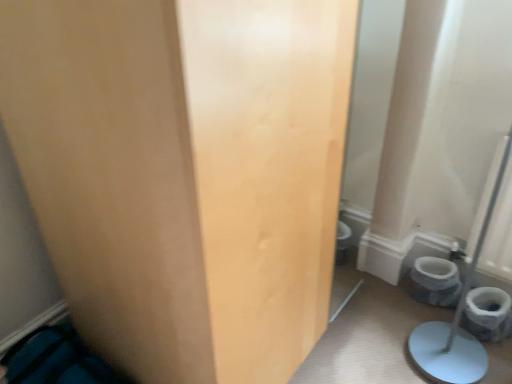
Question: From the image's perspective, would you say matte wood door at center is positioned over gray matte toilet bowl at lower right?

Choices:
 (A) no
 (B) yes

Answer: (B)

Question: From a real-world perspective, is matte wood door at center physically above gray matte toilet bowl at lower right?

Choices:
 (A) yes
 (B) no

Answer: (A)

Question: Does matte wood door at center appear on the left side of gray matte toilet bowl at lower right?

Choices:
 (A) yes
 (B) no

Answer: (A)

Question: Is matte wood door at center in front of gray matte toilet bowl at lower right?

Choices:
 (A) no
 (B) yes

Answer: (B)

Question: Is matte wood door at center positioned beyond the bounds of gray matte toilet bowl at lower right?

Choices:
 (A) no
 (B) yes

Answer: (B)

Question: Is matte wood door at center not close to gray matte toilet bowl at lower right?

Choices:
 (A) yes
 (B) no

Answer: (A)

Question: Can you confirm if gray matte toilet bowl at lower right is positioned to the right of matte wood door at center?

Choices:
 (A) no
 (B) yes

Answer: (B)

Question: Is gray matte toilet bowl at lower right positioned with its back to matte wood door at center?

Choices:
 (A) no
 (B) yes

Answer: (A)

Question: Is gray matte toilet bowl at lower right facing towards matte wood door at center?

Choices:
 (A) yes
 (B) no

Answer: (B)

Question: Can you confirm if gray matte toilet bowl at lower right is taller than matte wood door at center?

Choices:
 (A) no
 (B) yes

Answer: (A)

Question: From the image's perspective, is gray matte toilet bowl at lower right above matte wood door at center?

Choices:
 (A) yes
 (B) no

Answer: (B)

Question: Is matte wood door at center completely or partially inside gray matte toilet bowl at lower right?

Choices:
 (A) no
 (B) yes

Answer: (A)

Question: From a real-world perspective, relative to matte wood door at center, is gray matte toilet bowl at lower right vertically above or below?

Choices:
 (A) above
 (B) below

Answer: (B)